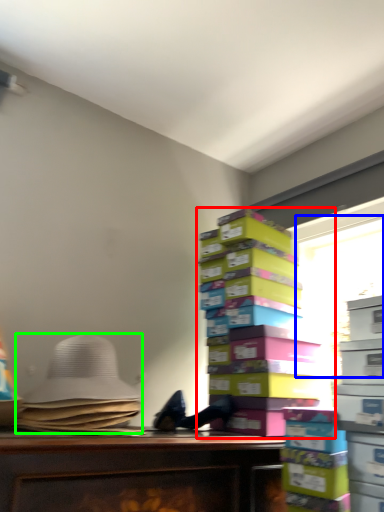
Question: Which is nearer to the book (highlighted by a red box)? window screen (highlighted by a blue box) or wide (highlighted by a green box).

Choices:
 (A) window screen
 (B) wide

Answer: (A)